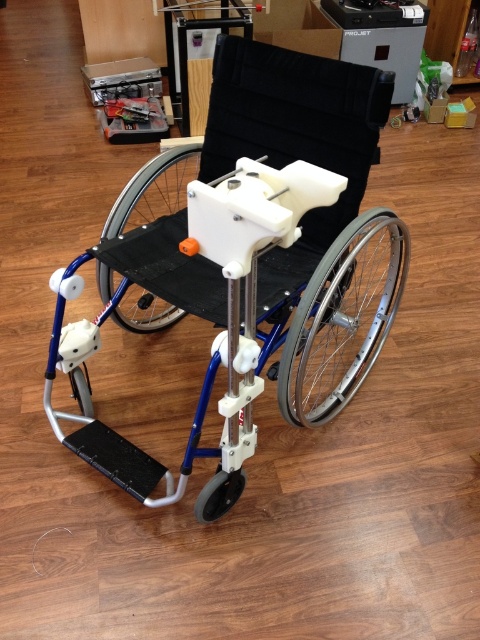
Question: Which point is closer to the camera?

Choices:
 (A) (376, 93)
 (B) (108, 280)
 (C) (86, 372)

Answer: (A)

Question: Among these points, which one is farthest from the camera?

Choices:
 (A) (330, 268)
 (B) (81, 378)

Answer: (B)

Question: Is silver metallic wheelchair at center bigger than white plastic wheel at center?

Choices:
 (A) no
 (B) yes

Answer: (B)

Question: Which object is farther from the camera taking this photo?

Choices:
 (A) silver metallic wheel at right
 (B) white plastic wheel at center

Answer: (B)

Question: In this image, where is white plastic wheel at center located relative to black rubber wheel at lower center?

Choices:
 (A) left
 (B) right

Answer: (A)

Question: Can you confirm if silver metallic wheelchair at center is positioned to the right of silver metallic wheel at lower left?

Choices:
 (A) yes
 (B) no

Answer: (A)